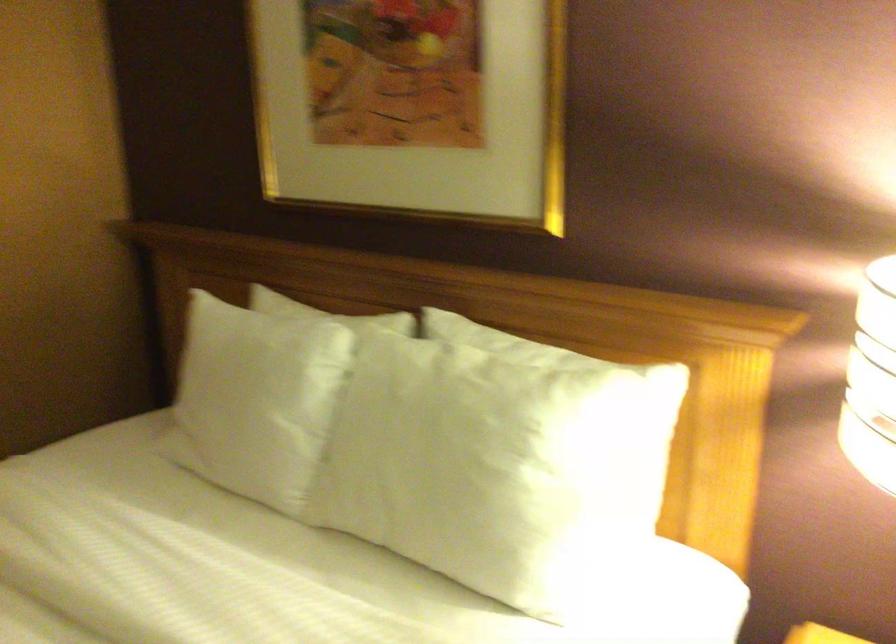
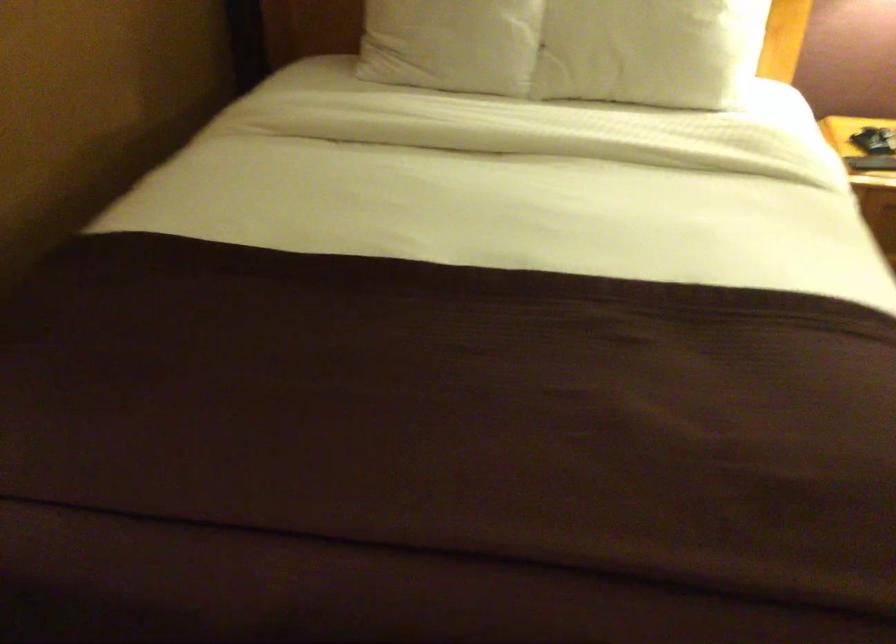
Which direction would the cameraman need to move to produce the second image?

The cameraman moved toward left, backward.